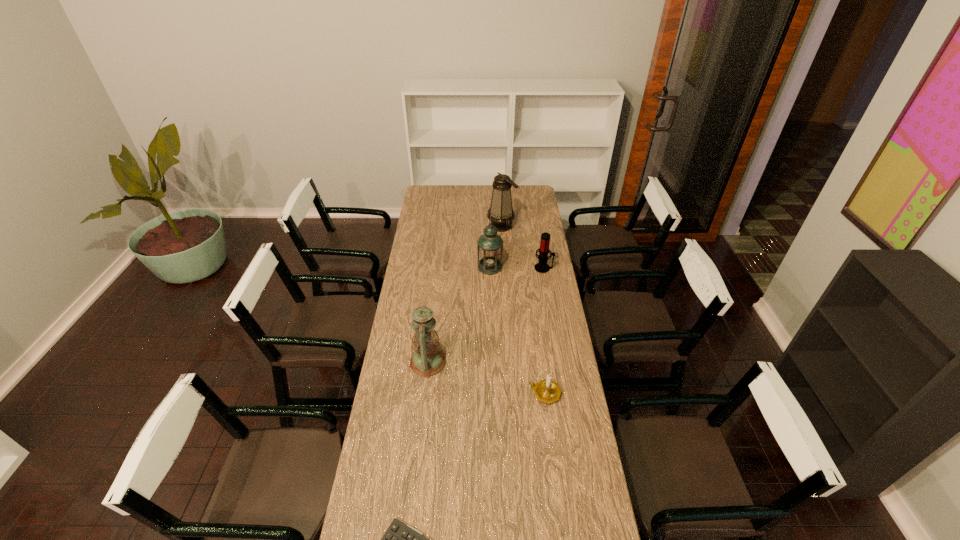
At what (x,y) coordinates should I click in order to perform the action: click on vacant point located 0.270m on the back of the third shortest object. Please return your answer as a coordinate pair (x, y). This screenshot has width=960, height=540. Looking at the image, I should click on (538, 233).

Image resolution: width=960 pixels, height=540 pixels. In order to click on free space located on the front of the candle holder in this screenshot , I will do `click(556, 474)`.

You are a GUI agent. You are given a task and a screenshot of the screen. Output one action in this format:
    pyautogui.click(x=<x>, y=<y>)
    Task: Click on the object present at the left edge
    Image resolution: width=960 pixels, height=540 pixels.
    Given the screenshot: What is the action you would take?
    pyautogui.click(x=427, y=360)

What are the coordinates of `microphone situated at the right edge` in the screenshot? It's located at (542, 267).

This screenshot has width=960, height=540. Identify the location of candle holder situated at the right edge. (548, 391).

In order to click on vacant space at the far edge of the desktop in this screenshot , I will do `click(455, 186)`.

What are the coordinates of `vacant space at the left edge of the desktop` in the screenshot? It's located at (397, 352).

Find the location of a particular element. The height and width of the screenshot is (540, 960). vacant space at the right edge of the desktop is located at coordinates (537, 313).

This screenshot has width=960, height=540. Identify the location of free region at the far left corner of the desktop. (436, 202).

At what (x,y) coordinates should I click in order to perform the action: click on empty location between the farthest oil lamp and the candle holder. Please return your answer as a coordinate pair (x, y). Looking at the image, I should click on (523, 309).